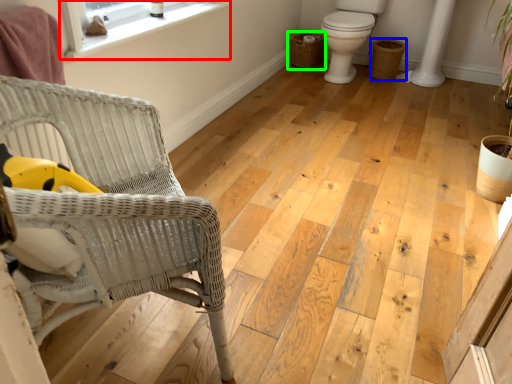
Question: Based on their relative distances, which object is nearer to window (highlighted by a red box)? Choose from basket (highlighted by a blue box) and basket (highlighted by a green box).

Choices:
 (A) basket
 (B) basket

Answer: (B)